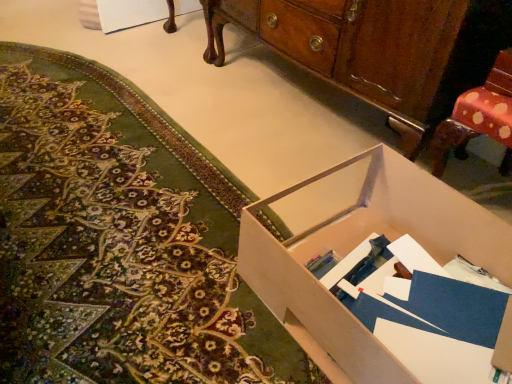
Question: From the image's perspective, is matte cardboard box at lower right under white cardboard box at center?

Choices:
 (A) yes
 (B) no

Answer: (B)

Question: Is matte cardboard box at lower right aimed at white cardboard box at center?

Choices:
 (A) no
 (B) yes

Answer: (A)

Question: Is matte cardboard box at lower right located outside white cardboard box at center?

Choices:
 (A) no
 (B) yes

Answer: (B)

Question: From a real-world perspective, is matte cardboard box at lower right physically above white cardboard box at center?

Choices:
 (A) no
 (B) yes

Answer: (A)

Question: Is matte cardboard box at lower right thinner than white cardboard box at center?

Choices:
 (A) no
 (B) yes

Answer: (A)

Question: Considering the relative positions of matte cardboard box at lower right and wooden cabinet at center in the image provided, is matte cardboard box at lower right to the left or to the right of wooden cabinet at center?

Choices:
 (A) right
 (B) left

Answer: (B)

Question: In the image, is matte cardboard box at lower right positioned in front of or behind wooden cabinet at center?

Choices:
 (A) front
 (B) behind

Answer: (A)

Question: Looking at their shapes, would you say matte cardboard box at lower right is wider or thinner than wooden cabinet at center?

Choices:
 (A) thin
 (B) wide

Answer: (B)

Question: Would you say matte cardboard box at lower right is inside or outside wooden cabinet at center?

Choices:
 (A) outside
 (B) inside

Answer: (A)

Question: From a real-world perspective, relative to matte cardboard box at lower right, is wooden cabinet at center vertically above or below?

Choices:
 (A) below
 (B) above

Answer: (B)

Question: From the image's perspective, relative to matte cardboard box at lower right, is wooden cabinet at center above or below?

Choices:
 (A) below
 (B) above

Answer: (B)

Question: Does point (482, 19) appear closer or farther from the camera than point (75, 205)?

Choices:
 (A) farther
 (B) closer

Answer: (B)

Question: Is wooden cabinet at center in front of or behind matte cardboard box at lower right in the image?

Choices:
 (A) front
 (B) behind

Answer: (B)

Question: Is matte cardboard box at lower right taller or shorter than white cardboard box at center?

Choices:
 (A) short
 (B) tall

Answer: (A)

Question: From a real-world perspective, is matte cardboard box at lower right physically located above or below white cardboard box at center?

Choices:
 (A) below
 (B) above

Answer: (A)